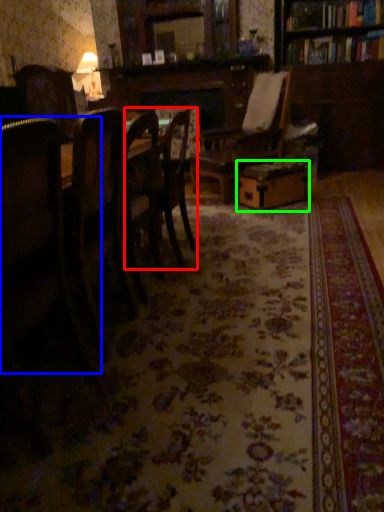
Question: Based on their relative distances, which object is farther from chair (highlighted by a red box)? Choose from chair (highlighted by a blue box) and cardboard box (highlighted by a green box).

Choices:
 (A) chair
 (B) cardboard box

Answer: (B)